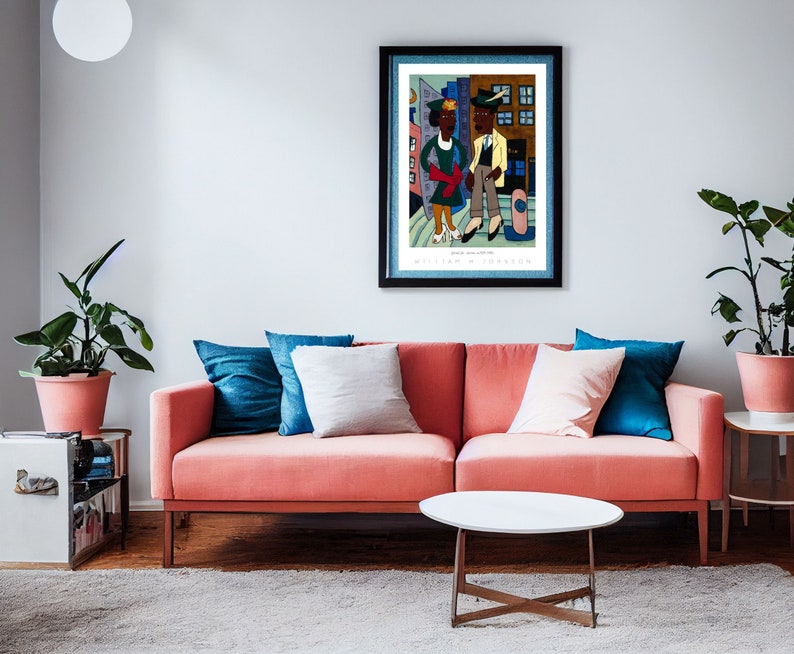
Locate an element on the screen. The image size is (794, 654). round lampshade near ceiling on left side is located at coordinates (106, 27).